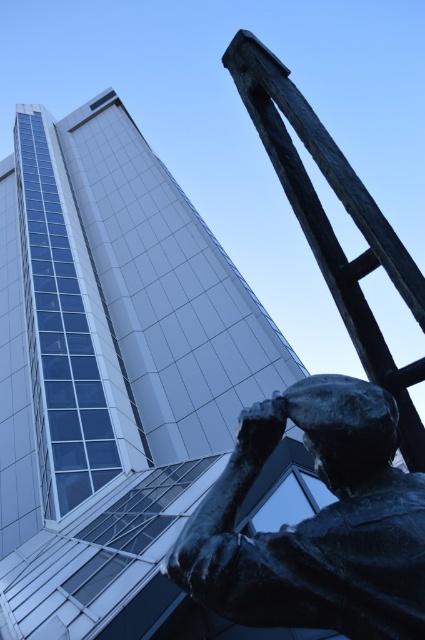
Can you confirm if smooth glass tower at upper left is smaller than bronze textured ladder at upper right?

Actually, smooth glass tower at upper left might be larger than bronze textured ladder at upper right.

Does smooth glass tower at upper left come in front of bronze textured ladder at upper right?

No.

Between point (271, 385) and point (345, 291), which one is positioned behind?

The point (271, 385) is behind.

The image size is (425, 640). Find the location of `smooth glass tower at upper left`. smooth glass tower at upper left is located at coordinates (110, 368).

Does point (371, 465) come closer to viewer compared to point (314, 157)?

Yes, it is in front of point (314, 157).

Who is taller, bronze statue at lower right or bronze textured ladder at upper right?

With more height is bronze textured ladder at upper right.

Where is `bronze statue at lower right`? bronze statue at lower right is located at coordinates (316, 522).

Is point (127, 424) positioned after point (297, 602)?

That is True.

Between point (212, 401) and point (234, 474), which one is positioned behind?

Point (212, 401)

This screenshot has height=640, width=425. I want to click on smooth glass tower at upper left, so click(110, 368).